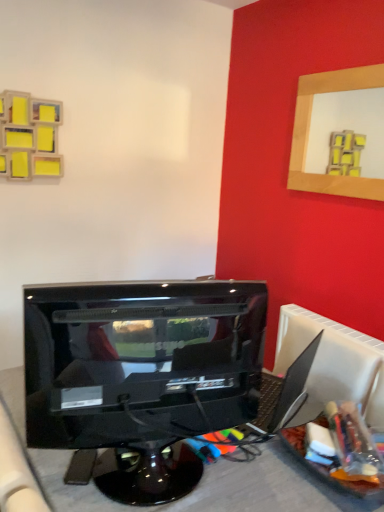
Measure the distance between glossy black monitor at center and camera.

glossy black monitor at center is 37.46 inches from camera.

The height and width of the screenshot is (512, 384). What do you see at coordinates (140, 374) in the screenshot? I see `glossy black monitor at center` at bounding box center [140, 374].

In the scene shown: What is the approximate height of glossy black monitor at center?

glossy black monitor at center is 19.16 inches in height.

Image resolution: width=384 pixels, height=512 pixels. Find the location of `glossy black monitor at center`. glossy black monitor at center is located at coordinates (140, 374).

The width and height of the screenshot is (384, 512). Describe the element at coordinates (309, 128) in the screenshot. I see `wooden picture frame at upper right` at that location.

Measure the distance between point (303, 89) and camera.

Point (303, 89) is 7.48 feet away from camera.

Where is `wooden picture frame at upper right`? The image size is (384, 512). wooden picture frame at upper right is located at coordinates (309, 128).

At what (x,y) coordinates should I click in order to perform the action: click on glossy black monitor at center. Please return your answer as a coordinate pair (x, y). Looking at the image, I should click on (140, 374).

Visually, is glossy black monitor at center positioned to the left or to the right of wooden picture frame at upper right?

In the image, glossy black monitor at center appears on the left side of wooden picture frame at upper right.

Based on the photo, considering the positions of objects glossy black monitor at center and wooden picture frame at upper right in the image provided, who is in front, glossy black monitor at center or wooden picture frame at upper right?

glossy black monitor at center.

Which is behind, point (220, 396) or point (348, 71)?

The point (348, 71) is farther from the camera.

From the image's perspective, between glossy black monitor at center and wooden picture frame at upper right, which one is located above?

wooden picture frame at upper right appears higher in the image.

From a real-world perspective, does glossy black monitor at center sit lower than wooden picture frame at upper right?

Correct, in the physical world, glossy black monitor at center is lower than wooden picture frame at upper right.

Does glossy black monitor at center have a greater width compared to wooden picture frame at upper right?

Indeed, glossy black monitor at center has a greater width compared to wooden picture frame at upper right.

In the scene shown: Can you confirm if glossy black monitor at center is taller than wooden picture frame at upper right?

No.

Is glossy black monitor at center bigger than wooden picture frame at upper right?

Yes, glossy black monitor at center is bigger than wooden picture frame at upper right.

Is glossy black monitor at center not within wooden picture frame at upper right?

Yes, glossy black monitor at center is not within wooden picture frame at upper right.

Would you say glossy black monitor at center is a long distance from wooden picture frame at upper right?

Yes, glossy black monitor at center is far from wooden picture frame at upper right.

Is glossy black monitor at center positioned with its back to wooden picture frame at upper right?

No, glossy black monitor at center is not facing the opposite direction of wooden picture frame at upper right.

How distant is glossy black monitor at center from wooden picture frame at upper right?

glossy black monitor at center and wooden picture frame at upper right are 1.38 meters apart from each other.

I want to click on computer monitor in front of the wooden picture frame at upper right, so click(x=140, y=374).

Considering the relative positions of wooden picture frame at upper right and glossy black monitor at center in the image provided, is wooden picture frame at upper right to the right of glossy black monitor at center from the viewer's perspective?

Yes, wooden picture frame at upper right is to the right of glossy black monitor at center.

Which is behind, wooden picture frame at upper right or glossy black monitor at center?

Positioned behind is wooden picture frame at upper right.

Which is in front, point (361, 193) or point (156, 386)?

Point (156, 386)

From the picture: From the image's perspective, between wooden picture frame at upper right and glossy black monitor at center, which one is located above?

wooden picture frame at upper right appears higher in the image.

From a real-world perspective, between wooden picture frame at upper right and glossy black monitor at center, who is vertically higher?

From a 3D spatial view, wooden picture frame at upper right is above.

Considering the sizes of wooden picture frame at upper right and glossy black monitor at center in the image, is wooden picture frame at upper right wider or thinner than glossy black monitor at center?

Clearly, wooden picture frame at upper right has less width compared to glossy black monitor at center.

From their relative heights in the image, would you say wooden picture frame at upper right is taller or shorter than glossy black monitor at center?

Clearly, wooden picture frame at upper right is taller compared to glossy black monitor at center.

Considering the sizes of objects wooden picture frame at upper right and glossy black monitor at center in the image provided, who is bigger, wooden picture frame at upper right or glossy black monitor at center?

Bigger between the two is glossy black monitor at center.

Is glossy black monitor at center a part of wooden picture frame at upper right?

No, glossy black monitor at center is located outside of wooden picture frame at upper right.

Are wooden picture frame at upper right and glossy black monitor at center making contact?

No, wooden picture frame at upper right is not in contact with glossy black monitor at center.

Is wooden picture frame at upper right facing away from glossy black monitor at center?

That's not correct — wooden picture frame at upper right is not looking away from glossy black monitor at center.

What's the angular difference between wooden picture frame at upper right and glossy black monitor at center's facing directions?

104 degrees.

This screenshot has width=384, height=512. I want to click on picture frame behind the glossy black monitor at center, so click(x=309, y=128).

The width and height of the screenshot is (384, 512). Identify the location of computer monitor below the wooden picture frame at upper right (from the image's perspective). (140, 374).

Image resolution: width=384 pixels, height=512 pixels. What are the coordinates of `picture frame that appears above the glossy black monitor at center (from a real-world perspective)` in the screenshot? It's located at (309, 128).